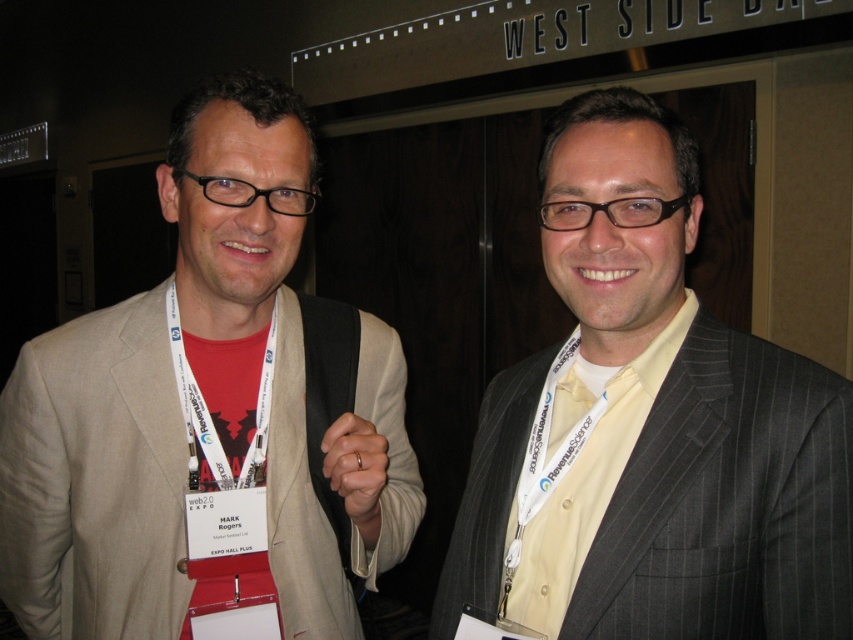
Which is more to the left, red matte neck at center or yellow fabric at center?

red matte neck at center

Does red matte neck at center appear under yellow fabric at center?

Actually, red matte neck at center is above yellow fabric at center.

The image size is (853, 640). What do you see at coordinates (225, 284) in the screenshot?
I see `red matte neck at center` at bounding box center [225, 284].

At what (x,y) coordinates should I click in order to perform the action: click on red matte neck at center. Please return your answer as a coordinate pair (x, y). This screenshot has height=640, width=853. Looking at the image, I should click on (225, 284).

Does point (386, 362) lie behind point (456, 522)?

Yes, it is behind point (456, 522).

Measure the distance between point (129, 518) and camera.

36.26 inches

Find the location of a particular element. The width and height of the screenshot is (853, 640). matte beige suit at center is located at coordinates (194, 476).

What do you see at coordinates (194, 476) in the screenshot? I see `matte beige suit at center` at bounding box center [194, 476].

Which of these two, matte beige suit at center or red matte neck at center, stands taller?

With more height is matte beige suit at center.

Who is more forward, (106, 620) or (201, 321)?

Point (106, 620)

Locate an element on the screen. This screenshot has height=640, width=853. matte beige suit at center is located at coordinates (194, 476).